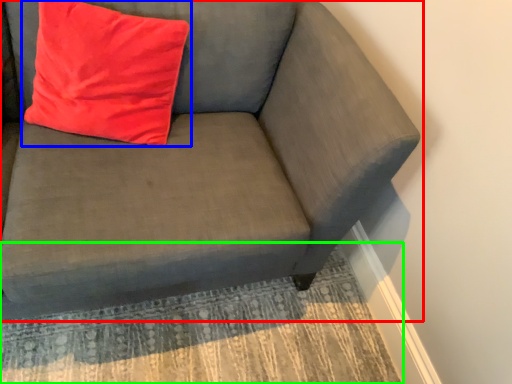
Question: Considering the real-world distances, which object is closest to studio couch (highlighted by a red box)? pillow (highlighted by a blue box) or mat (highlighted by a green box).

Choices:
 (A) pillow
 (B) mat

Answer: (A)